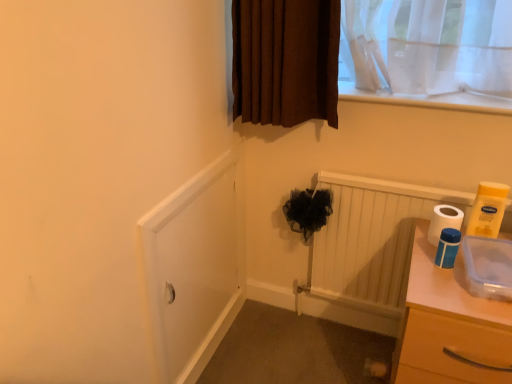
Question: Is the depth of white matte screen door at lower left less than that of white glossy toilet paper at right, the first toilet paper when ordered from right to left?

Choices:
 (A) no
 (B) yes

Answer: (A)

Question: Is white matte screen door at lower left aimed at white glossy toilet paper at right, which is counted as the 3th toilet paper, starting from the left?

Choices:
 (A) no
 (B) yes

Answer: (B)

Question: Considering the relative sizes of white matte screen door at lower left and white glossy toilet paper at right, the first toilet paper when ordered from right to left, in the image provided, is white matte screen door at lower left bigger than white glossy toilet paper at right, the first toilet paper when ordered from right to left,?

Choices:
 (A) no
 (B) yes

Answer: (B)

Question: Is there a large distance between white matte screen door at lower left and white glossy toilet paper at right, the first toilet paper when ordered from right to left?

Choices:
 (A) no
 (B) yes

Answer: (A)

Question: Is white glossy toilet paper at right, the first toilet paper when ordered from right to left, at the back of white matte screen door at lower left?

Choices:
 (A) yes
 (B) no

Answer: (B)

Question: From a real-world perspective, is white matte screen door at lower left under white glossy toilet paper at right, the first toilet paper when ordered from right to left?

Choices:
 (A) yes
 (B) no

Answer: (A)

Question: From the image's perspective, is clear plastic chest of drawers at right located beneath blue plastic toilet paper at right, marked as the first toilet paper in a left-to-right arrangement?

Choices:
 (A) yes
 (B) no

Answer: (A)

Question: Is clear plastic chest of drawers at right at the right side of blue plastic toilet paper at right, which is the third toilet paper from right to left?

Choices:
 (A) yes
 (B) no

Answer: (A)

Question: Could you tell me if clear plastic chest of drawers at right is turned towards blue plastic toilet paper at right, which is the third toilet paper from right to left?

Choices:
 (A) yes
 (B) no

Answer: (B)

Question: From the image's perspective, is clear plastic chest of drawers at right over blue plastic toilet paper at right, marked as the first toilet paper in a left-to-right arrangement?

Choices:
 (A) yes
 (B) no

Answer: (B)

Question: Does clear plastic chest of drawers at right have a greater width compared to blue plastic toilet paper at right, marked as the first toilet paper in a left-to-right arrangement?

Choices:
 (A) yes
 (B) no

Answer: (A)

Question: Can you confirm if clear plastic chest of drawers at right is smaller than blue plastic toilet paper at right, which is the third toilet paper from right to left?

Choices:
 (A) no
 (B) yes

Answer: (A)

Question: From the image's perspective, would you say white glossy toilet paper at right, which is counted as the 3th toilet paper, starting from the left, is shown under blue plastic toilet paper at right, marked as the first toilet paper in a left-to-right arrangement?

Choices:
 (A) yes
 (B) no

Answer: (B)